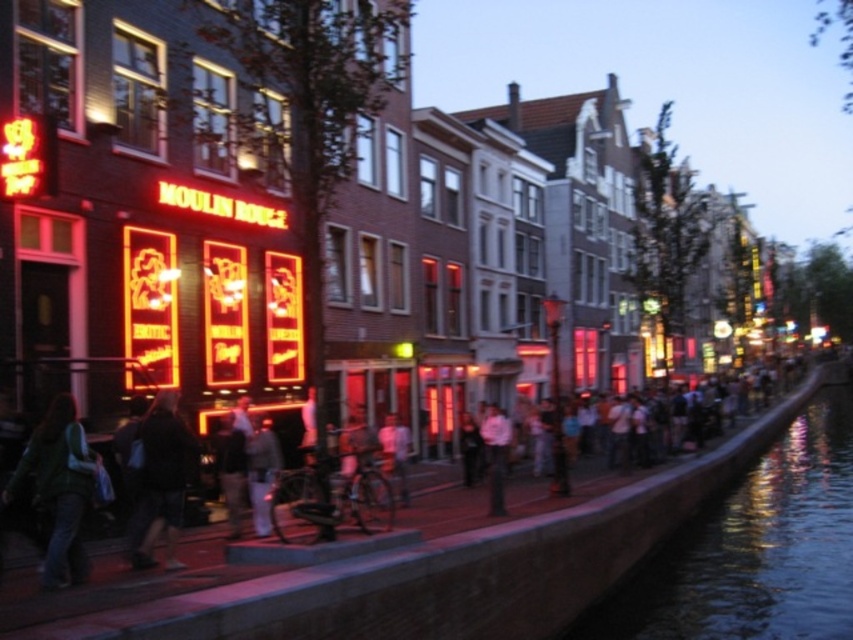
Question: Where is dark blue liquid at lower right located in relation to dark gray jacket at center in the image?

Choices:
 (A) above
 (B) below

Answer: (B)

Question: Which is nearer to the dark gray jacket at center?

Choices:
 (A) dark blue liquid at lower right
 (B) green fabric jacket at lower left

Answer: (B)

Question: Which of these objects is positioned closest to the dark blue liquid at lower right?

Choices:
 (A) green fabric jacket at lower left
 (B) dark gray jacket at center

Answer: (B)

Question: Does dark blue liquid at lower right have a lesser width compared to green fabric jacket at lower left?

Choices:
 (A) no
 (B) yes

Answer: (A)

Question: Which object appears closest to the camera in this image?

Choices:
 (A) dark blue liquid at lower right
 (B) green fabric jacket at lower left

Answer: (B)

Question: Considering the relative positions of green fabric jacket at lower left and dark gray jacket at center in the image provided, where is green fabric jacket at lower left located with respect to dark gray jacket at center?

Choices:
 (A) above
 (B) below

Answer: (A)